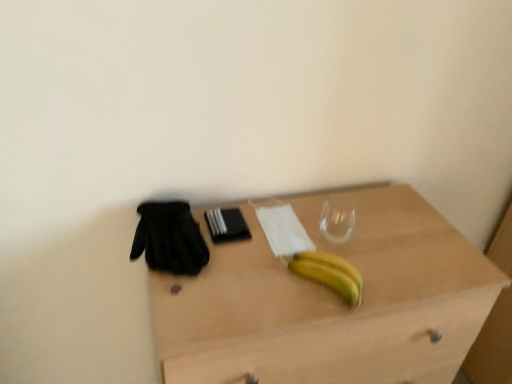
Question: From a real-world perspective, does yellow matte banana at center stand above black mesh glove at left?

Choices:
 (A) yes
 (B) no

Answer: (B)

Question: Can you confirm if yellow matte banana at center is smaller than black mesh glove at left?

Choices:
 (A) no
 (B) yes

Answer: (B)

Question: Is yellow matte banana at center behind black mesh glove at left?

Choices:
 (A) yes
 (B) no

Answer: (B)

Question: Are yellow matte banana at center and black mesh glove at left located far from each other?

Choices:
 (A) no
 (B) yes

Answer: (A)

Question: Is yellow matte banana at center at the right side of black mesh glove at left?

Choices:
 (A) yes
 (B) no

Answer: (A)

Question: Is yellow matte banana at center surrounding black mesh glove at left?

Choices:
 (A) yes
 (B) no

Answer: (B)

Question: Can you confirm if black mesh glove at left is smaller than yellow matte banana at center?

Choices:
 (A) no
 (B) yes

Answer: (A)

Question: Is black mesh glove at left outside of yellow matte banana at center?

Choices:
 (A) no
 (B) yes

Answer: (B)

Question: Is the depth of black mesh glove at left greater than that of yellow matte banana at center?

Choices:
 (A) no
 (B) yes

Answer: (B)

Question: From the image's perspective, is black mesh glove at left under yellow matte banana at center?

Choices:
 (A) no
 (B) yes

Answer: (A)

Question: Can you confirm if black mesh glove at left is taller than yellow matte banana at center?

Choices:
 (A) no
 (B) yes

Answer: (B)

Question: Does black mesh glove at left come in front of yellow matte banana at center?

Choices:
 (A) yes
 (B) no

Answer: (B)

Question: Can you confirm if black mesh glove at left is wider than light wood desk at center?

Choices:
 (A) no
 (B) yes

Answer: (A)